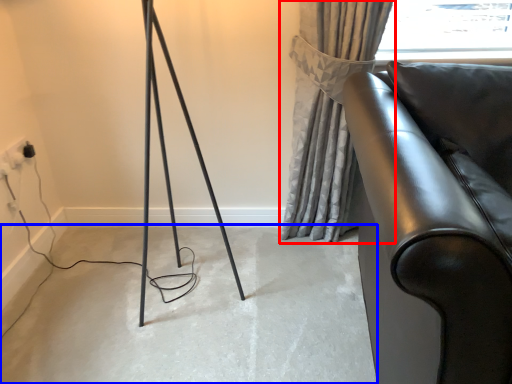
Question: Which object is further to the camera taking this photo, curtain (highlighted by a red box) or concrete (highlighted by a blue box)?

Choices:
 (A) curtain
 (B) concrete

Answer: (A)